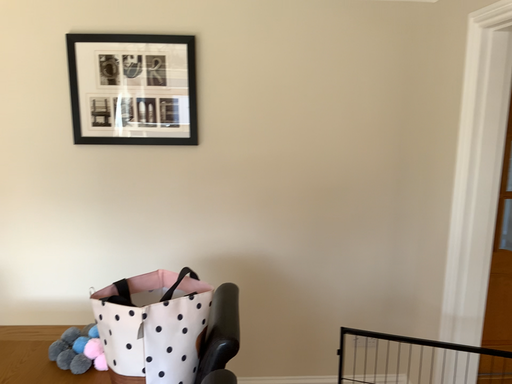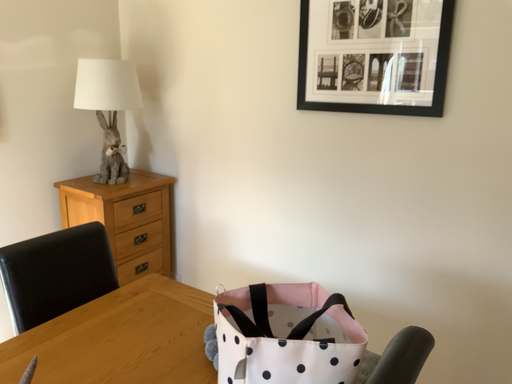
Question: How did the camera likely rotate when shooting the video?

Choices:
 (A) rotated left
 (B) rotated right

Answer: (A)